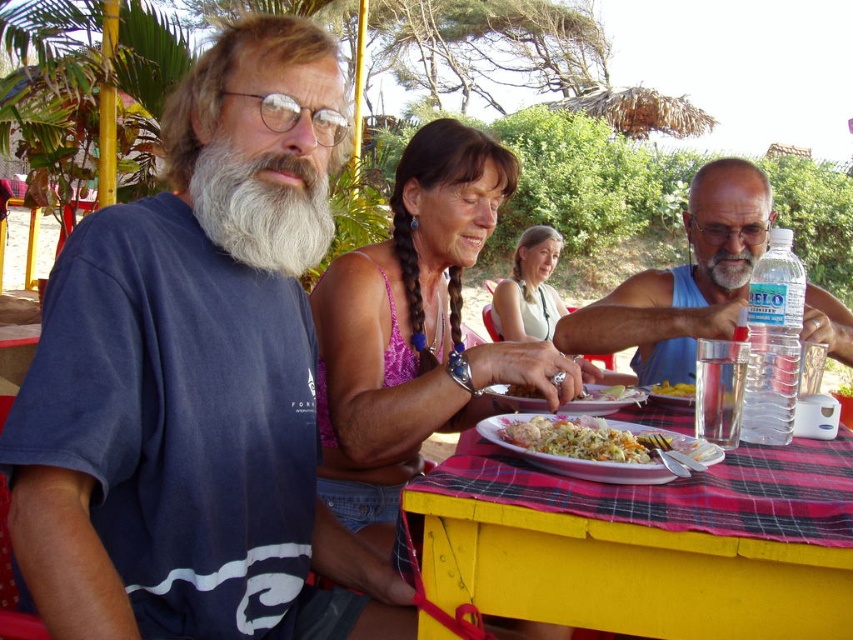
You are a photographer taking a picture of the two people at the table. You notice the blue tank top at center and the matte pink tank top at center. Which one is positioned lower in the image?

The blue tank top at center is below the matte pink tank top at center, so the blue tank top at center is positioned lower in the image.